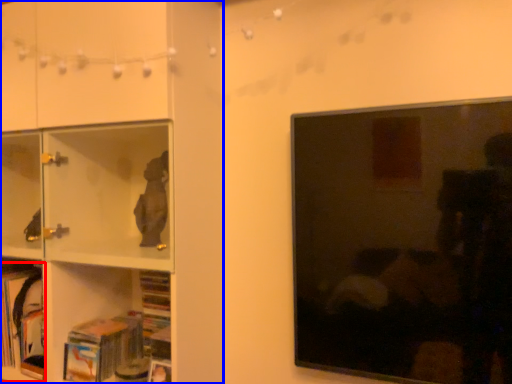
Question: Which object appears closest to the camera in this image, book (highlighted by a red box) or shelf (highlighted by a blue box)?

Choices:
 (A) book
 (B) shelf

Answer: (B)